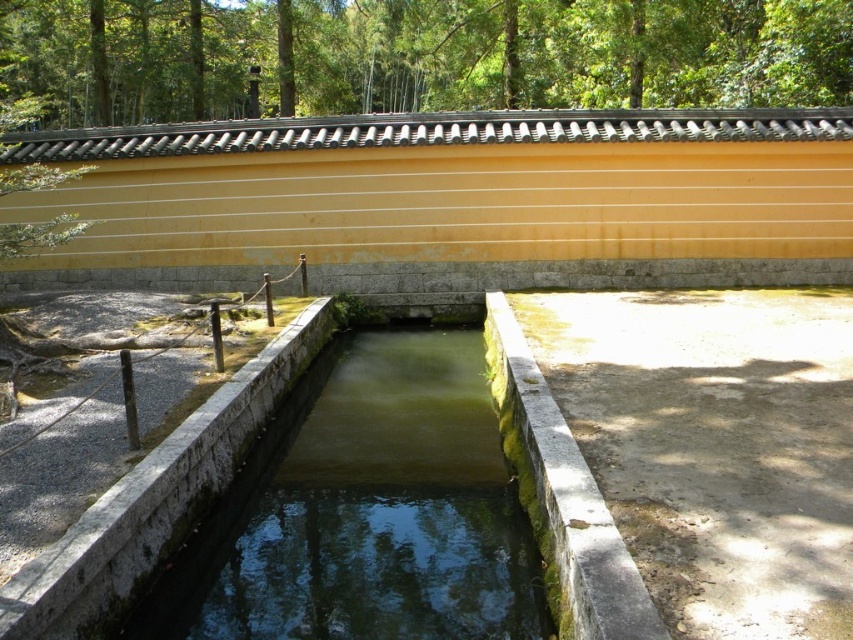
Question: Can you confirm if green leafy tree at upper center is thinner than green mossy stone water at center?

Choices:
 (A) no
 (B) yes

Answer: (A)

Question: Is green leafy tree at upper center smaller than green mossy stone water at center?

Choices:
 (A) yes
 (B) no

Answer: (B)

Question: Which of the following is the closest to the observer?

Choices:
 (A) green leafy tree at upper center
 (B) green mossy stone water at center

Answer: (B)

Question: Does green leafy tree at upper center appear under green mossy stone water at center?

Choices:
 (A) yes
 (B) no

Answer: (B)

Question: Which object appears closest to the camera in this image?

Choices:
 (A) green leafy tree at upper center
 (B) green mossy stone water at center

Answer: (B)